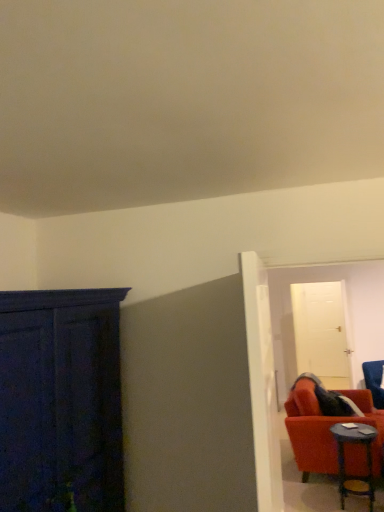
Describe the element at coordinates (262, 383) in the screenshot. I see `white glossy door at center, acting as the first door starting from the front` at that location.

You are a GUI agent. You are given a task and a screenshot of the screen. Output one action in this format:
    pyautogui.click(x=<x>, y=<y>)
    Task: Click on the velvet blue armchair at right
    The width and height of the screenshot is (384, 512).
    Given the screenshot: What is the action you would take?
    pyautogui.click(x=374, y=381)

Is white glossy door at center, the second door when ordered from back to front, facing towards wooden round table at lower right?

No, white glossy door at center, the second door when ordered from back to front, does not turn towards wooden round table at lower right.

From a real-world perspective, who is located lower, white glossy door at center, acting as the first door starting from the front, or wooden round table at lower right?

From a 3D spatial view, wooden round table at lower right is below.

Which object is positioned more to the right, white glossy door at center, the 1th door viewed from the left, or wooden round table at lower right?

Positioned to the right is wooden round table at lower right.

Who is bigger, white glossy door at center, the 1th door viewed from the left, or wooden round table at lower right?

Bigger between the two is white glossy door at center, the 1th door viewed from the left.

Which of these two, velvet blue armchair at right or wooden round table at lower right, stands shorter?

Standing shorter between the two is wooden round table at lower right.

Is velvet blue armchair at right aimed at wooden round table at lower right?

No, velvet blue armchair at right is not facing towards wooden round table at lower right.

Does velvet blue armchair at right have a larger size compared to wooden round table at lower right?

Yes.

Do you think velvet blue armchair at right is within wooden round table at lower right, or outside of it?

velvet blue armchair at right cannot be found inside wooden round table at lower right.

Can you see white glossy door at upper right, placed as the second door when sorted from left to right, touching white glossy door at center, the second door in the right-to-left sequence?

No, white glossy door at upper right, placed as the second door when sorted from left to right, is not making contact with white glossy door at center, the second door in the right-to-left sequence.

How many degrees apart are the facing directions of white glossy door at upper right, which is the 2th door from front to back, and white glossy door at center, acting as the first door starting from the front?

The angular difference between white glossy door at upper right, which is the 2th door from front to back, and white glossy door at center, acting as the first door starting from the front, is 97.1 degrees.

Can white glossy door at center, the 1th door viewed from the left, be found inside white glossy door at upper right, which ranks as the 1th door in back-to-front order?

No, white glossy door at center, the 1th door viewed from the left, is not a part of white glossy door at upper right, which ranks as the 1th door in back-to-front order.

Considering the positions of objects white glossy door at upper right, positioned as the 1th door in right-to-left order, and white glossy door at center, acting as the first door starting from the front, in the image provided, who is in front, white glossy door at upper right, positioned as the 1th door in right-to-left order, or white glossy door at center, acting as the first door starting from the front,?

white glossy door at center, acting as the first door starting from the front, is in front.

Does white glossy door at center, acting as the first door starting from the front, turn towards white glossy door at upper right, which ranks as the 1th door in back-to-front order?

No, white glossy door at center, acting as the first door starting from the front, is not aimed at white glossy door at upper right, which ranks as the 1th door in back-to-front order.

Looking at this image, between white glossy door at center, the second door in the right-to-left sequence, and white glossy door at upper right, placed as the second door when sorted from left to right, which one has more height?

With more height is white glossy door at upper right, placed as the second door when sorted from left to right.

Is there a large distance between white glossy door at center, the second door when ordered from back to front, and white glossy door at upper right, which is the 2th door from front to back?

Yes.

How distant is white glossy door at center, the second door when ordered from back to front, from white glossy door at upper right, placed as the second door when sorted from left to right?

white glossy door at center, the second door when ordered from back to front, and white glossy door at upper right, placed as the second door when sorted from left to right, are 4.22 meters apart.

Is velvet blue armchair at right wider or thinner than white glossy door at center, the second door in the right-to-left sequence?

Clearly, velvet blue armchair at right has more width compared to white glossy door at center, the second door in the right-to-left sequence.

The height and width of the screenshot is (512, 384). What are the coordinates of `chair behind the white glossy door at center, the 1th door viewed from the left` in the screenshot? It's located at (374, 381).

In the image, is velvet blue armchair at right positioned in front of or behind white glossy door at center, the 1th door viewed from the left?

In the image, velvet blue armchair at right appears behind white glossy door at center, the 1th door viewed from the left.

Considering the sizes of objects wooden round table at lower right and velvet blue armchair at right in the image provided, who is bigger, wooden round table at lower right or velvet blue armchair at right?

Bigger between the two is velvet blue armchair at right.

Is wooden round table at lower right thinner than velvet blue armchair at right?

Indeed, wooden round table at lower right has a lesser width compared to velvet blue armchair at right.

Is wooden round table at lower right next to velvet blue armchair at right?

wooden round table at lower right and velvet blue armchair at right are clearly separated.

From the image's perspective, which is above, white glossy door at center, the second door in the right-to-left sequence, or velvet blue armchair at right?

white glossy door at center, the second door in the right-to-left sequence, appears higher in the image.

From a real-world perspective, between white glossy door at center, the 1th door viewed from the left, and velvet blue armchair at right, who is vertically lower?

velvet blue armchair at right, from a real-world perspective.

Is white glossy door at center, the second door when ordered from back to front, at the left side of velvet blue armchair at right?

Indeed, white glossy door at center, the second door when ordered from back to front, is positioned on the left side of velvet blue armchair at right.

Looking at their sizes, would you say white glossy door at center, the 1th door viewed from the left, is wider or thinner than velvet blue armchair at right?

white glossy door at center, the 1th door viewed from the left, is thinner than velvet blue armchair at right.

Identify the location of table behind the white glossy door at center, the second door in the right-to-left sequence. tap(344, 459).

The height and width of the screenshot is (512, 384). I want to click on table located above the velvet blue armchair at right (from the image's perspective), so click(x=344, y=459).

Looking at the image, which one is located closer to wooden round table at lower right, velvet blue armchair at right or white glossy door at center, the 1th door viewed from the left?

velvet blue armchair at right.

Which object lies nearer to the anchor point white glossy door at upper right, positioned as the 1th door in right-to-left order, wooden round table at lower right or velvet blue armchair at right?

velvet blue armchair at right lies closer to white glossy door at upper right, positioned as the 1th door in right-to-left order, than the other object.

Looking at the image, which one is located closer to white glossy door at center, acting as the first door starting from the front, white glossy door at upper right, placed as the second door when sorted from left to right, or velvet blue armchair at right?

velvet blue armchair at right lies closer to white glossy door at center, acting as the first door starting from the front, than the other object.

Estimate the real-world distances between objects in this image. Which object is further from white glossy door at upper right, placed as the second door when sorted from left to right, velvet blue armchair at right or wooden round table at lower right?

wooden round table at lower right lies further to white glossy door at upper right, placed as the second door when sorted from left to right, than the other object.

When comparing their distances from wooden round table at lower right, does white glossy door at upper right, which ranks as the 1th door in back-to-front order, or velvet blue armchair at right seem closer?

velvet blue armchair at right lies closer to wooden round table at lower right than the other object.

Considering their positions, is velvet blue armchair at right positioned further to wooden round table at lower right than white glossy door at upper right, which is the 2th door from front to back?

white glossy door at upper right, which is the 2th door from front to back.

Consider the image. When comparing their distances from white glossy door at center, the second door when ordered from back to front, does wooden round table at lower right or white glossy door at upper right, placed as the second door when sorted from left to right, seem further?

white glossy door at upper right, placed as the second door when sorted from left to right, lies further to white glossy door at center, the second door when ordered from back to front, than the other object.

Considering their positions, is white glossy door at center, the second door when ordered from back to front, positioned further to wooden round table at lower right than white glossy door at upper right, positioned as the 1th door in right-to-left order?

The object further to wooden round table at lower right is white glossy door at center, the second door when ordered from back to front.

Where is `table between white glossy door at center, the second door when ordered from back to front, and white glossy door at upper right, which is the 2th door from front to back, from front to back`? This screenshot has width=384, height=512. table between white glossy door at center, the second door when ordered from back to front, and white glossy door at upper right, which is the 2th door from front to back, from front to back is located at coordinates (344, 459).

In order to click on chair between wooden round table at lower right and white glossy door at upper right, placed as the second door when sorted from left to right, along the z-axis in this screenshot , I will do `click(374, 381)`.

Where is `chair between white glossy door at center, the second door in the right-to-left sequence, and white glossy door at upper right, which ranks as the 1th door in back-to-front order, along the z-axis`? The height and width of the screenshot is (512, 384). chair between white glossy door at center, the second door in the right-to-left sequence, and white glossy door at upper right, which ranks as the 1th door in back-to-front order, along the z-axis is located at coordinates (374, 381).

The image size is (384, 512). In order to click on table between white glossy door at center, the second door when ordered from back to front, and velvet blue armchair at right, along the z-axis in this screenshot , I will do `click(344, 459)`.